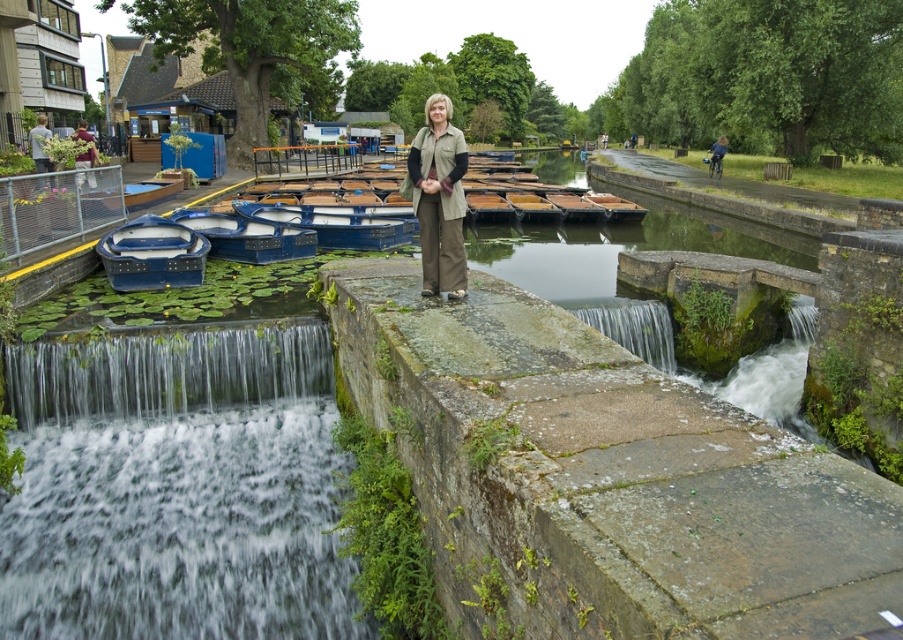
Question: Does blue plastic boats at center have a greater width compared to wooden boat at center?

Choices:
 (A) yes
 (B) no

Answer: (A)

Question: Where is khaki fabric jacket at center located in relation to blue plastic boats at center in the image?

Choices:
 (A) right
 (B) left

Answer: (A)

Question: Which of the following is the farthest from the observer?

Choices:
 (A) blue plastic boat at left
 (B) gray stone waterfall at center
 (C) blue plastic boats at center
 (D) maroon fabric jacket at upper left

Answer: (C)

Question: Which of the following is the farthest from the observer?

Choices:
 (A) wooden boat at center
 (B) blue polished wood boat at center

Answer: (A)

Question: Which of these objects is positioned closest to the blue plastic boat at left?

Choices:
 (A) blue plastic boats at center
 (B) khaki fabric jacket at center

Answer: (A)

Question: In this image, where is clear water at center located relative to blue denim jacket at center?

Choices:
 (A) below
 (B) above

Answer: (A)